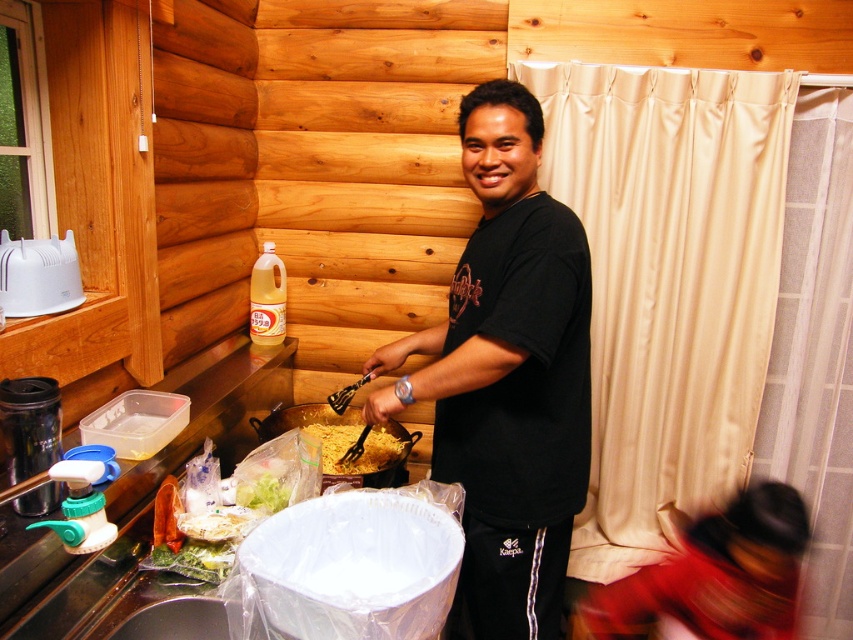
You are a guest in this cabin kitchen and need to locate the black matte shirt at center. According to the scene description, where would you find it?

The black matte shirt at center is located at point (508, 374), which corresponds to the center area of the image where the man is standing at the counter wearing it.

You are a chef in a cabin kitchen and need to reach for an ingredient located 18 inches away from your current position. You see the black matte shirt at center and the smooth black shirt at center. Which shirt should you move closer to the ingredient to ensure you can reach it?

The black matte shirt at center is 17.20 inches from the smooth black shirt at center. To reach the ingredient located 18 inches away, you should move the smooth black shirt at center closer to the ingredient since it is already within the 17.20 inch proximity to the black matte shirt, allowing you to bridge the distance.

You are a fashion designer observing two black shirts in the center of the image. Which one has a greater width? The black matte shirt at center or the smooth black shirt at center?

The black matte shirt at center has a greater width than the smooth black shirt at center.